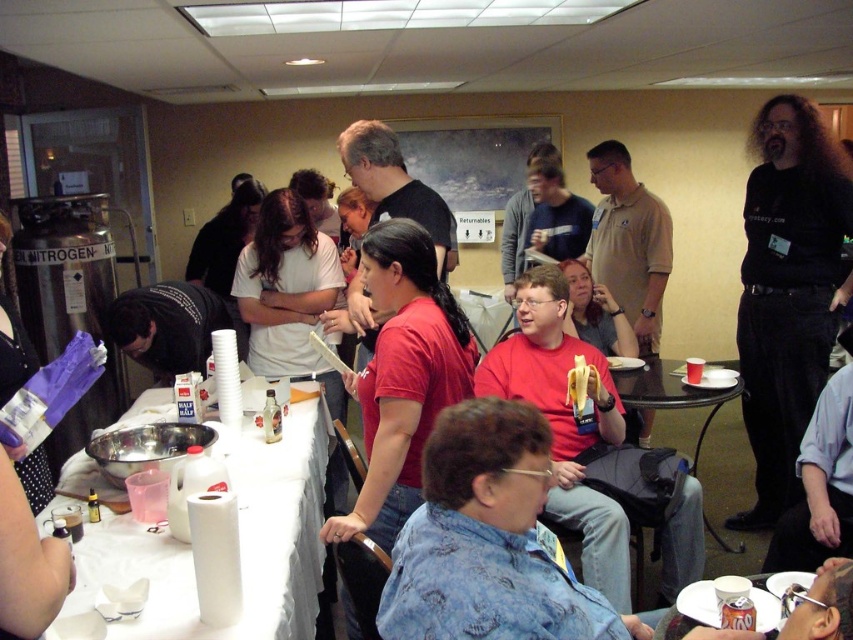
Which is below, white paper towel at lower left or black matte shirt at left?

white paper towel at lower left is below.

Image resolution: width=853 pixels, height=640 pixels. In order to click on white paper towel at lower left in this screenshot , I will do `click(239, 538)`.

Does point (172, 563) come closer to viewer compared to point (196, 285)?

That is True.

Locate an element on the screen. The image size is (853, 640). white paper towel at lower left is located at coordinates (239, 538).

Is black matte shirt at upper right in front of white paper towel at lower left?

No, it is not.

Which is more to the right, black matte shirt at upper right or white paper towel at lower left?

From the viewer's perspective, black matte shirt at upper right appears more on the right side.

Describe the element at coordinates (787, 291) in the screenshot. I see `black matte shirt at upper right` at that location.

At what (x,y) coordinates should I click in order to perform the action: click on black matte shirt at upper right. Please return your answer as a coordinate pair (x, y). Image resolution: width=853 pixels, height=640 pixels. Looking at the image, I should click on (787, 291).

Does black matte shirt at left have a smaller size compared to black plastic table at center?

Yes.

Does black matte shirt at left have a lesser width compared to black plastic table at center?

Correct, black matte shirt at left's width is less than black plastic table at center's.

The height and width of the screenshot is (640, 853). Describe the element at coordinates (170, 326) in the screenshot. I see `black matte shirt at left` at that location.

This screenshot has width=853, height=640. In order to click on black matte shirt at left in this screenshot , I will do `click(170, 326)`.